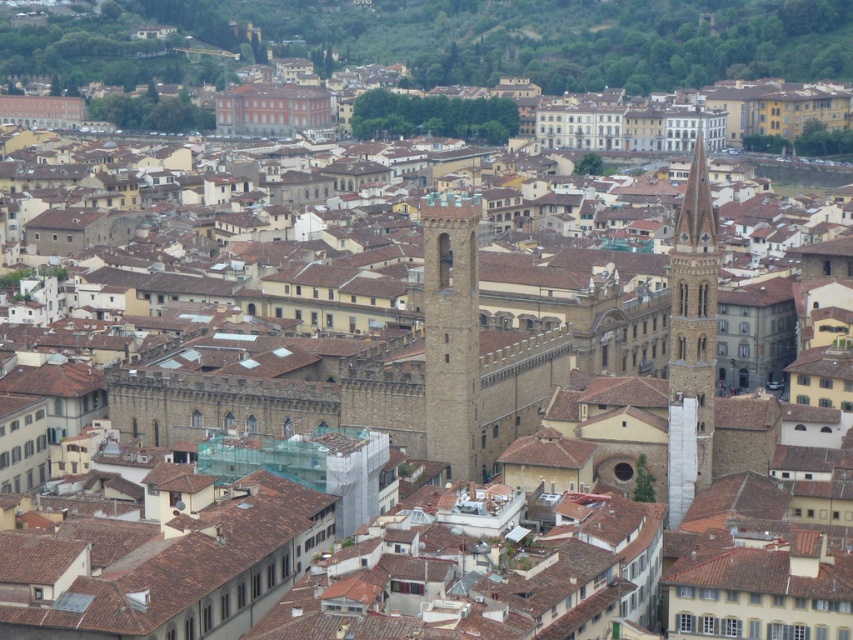
Does brown stone tower at center have a larger size compared to brown stone tower at center-right?

Incorrect, brown stone tower at center is not larger than brown stone tower at center-right.

Is point (451, 250) more distant than point (672, 273)?

Yes.

Locate an element on the screen. The height and width of the screenshot is (640, 853). brown stone tower at center is located at coordinates (451, 332).